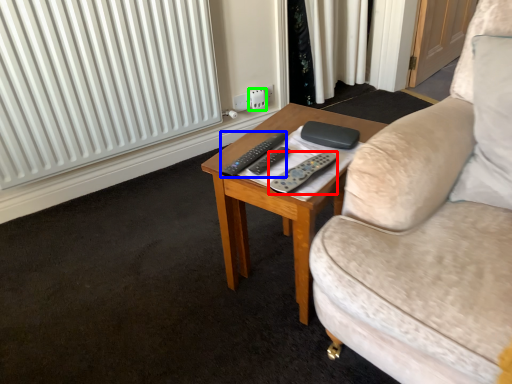
Question: Which is farther away from remote control (highlighted by a red box)? remote control (highlighted by a blue box) or electric outlet (highlighted by a green box)?

Choices:
 (A) remote control
 (B) electric outlet

Answer: (B)